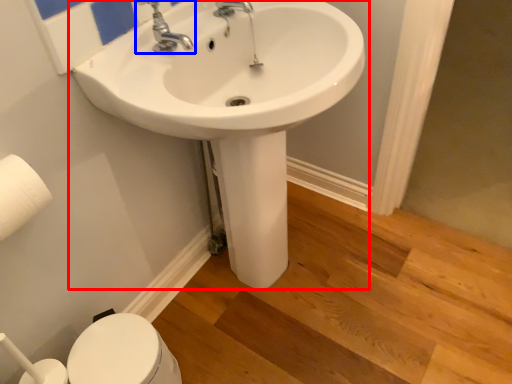
Question: Among these objects, which one is nearest to the camera, sink (highlighted by a red box) or tap (highlighted by a blue box)?

Choices:
 (A) sink
 (B) tap

Answer: (A)